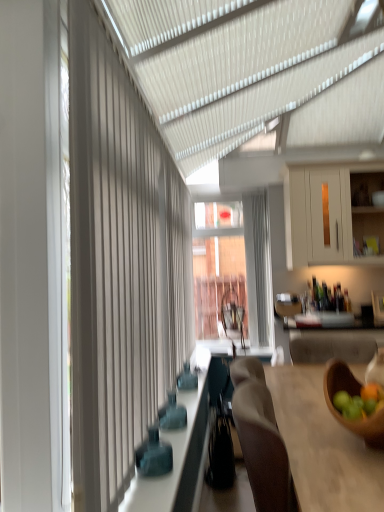
Question: Is white textured curtain at left at the right side of white matte cabinet at upper right?

Choices:
 (A) no
 (B) yes

Answer: (A)

Question: From a real-world perspective, is white textured curtain at left located higher than white matte cabinet at upper right?

Choices:
 (A) no
 (B) yes

Answer: (A)

Question: Is white textured curtain at left closer to camera compared to white matte cabinet at upper right?

Choices:
 (A) no
 (B) yes

Answer: (B)

Question: Considering the relative positions of white textured curtain at left and white matte cabinet at upper right in the image provided, is white textured curtain at left to the left of white matte cabinet at upper right from the viewer's perspective?

Choices:
 (A) yes
 (B) no

Answer: (A)

Question: Is white textured curtain at left thinner than white matte cabinet at upper right?

Choices:
 (A) no
 (B) yes

Answer: (B)

Question: Considering the relative sizes of white textured curtain at left and white matte cabinet at upper right in the image provided, is white textured curtain at left taller than white matte cabinet at upper right?

Choices:
 (A) yes
 (B) no

Answer: (A)

Question: Does wooden bowl at lower right have a lesser height compared to white textured curtain at left?

Choices:
 (A) yes
 (B) no

Answer: (A)

Question: Is wooden bowl at lower right oriented towards white textured curtain at left?

Choices:
 (A) yes
 (B) no

Answer: (B)

Question: Can you confirm if wooden bowl at lower right is wider than white textured curtain at left?

Choices:
 (A) yes
 (B) no

Answer: (A)

Question: Considering the relative positions of wooden bowl at lower right and white textured curtain at left in the image provided, is wooden bowl at lower right to the right of white textured curtain at left from the viewer's perspective?

Choices:
 (A) yes
 (B) no

Answer: (A)

Question: Is wooden bowl at lower right positioned in front of white textured curtain at left?

Choices:
 (A) yes
 (B) no

Answer: (B)

Question: Is wooden bowl at lower right directly adjacent to white textured curtain at left?

Choices:
 (A) yes
 (B) no

Answer: (B)

Question: Would you consider white matte cabinet at upper right to be distant from matte blue glass bottles at center?

Choices:
 (A) yes
 (B) no

Answer: (A)